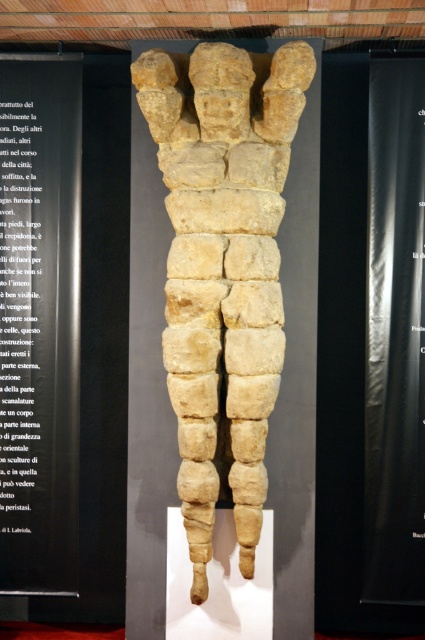
Question: Is yellow stone statue at center bigger than black matte poster at right?

Choices:
 (A) no
 (B) yes

Answer: (B)

Question: Which point is farther to the camera?

Choices:
 (A) (16, 163)
 (B) (368, 134)
 (C) (67, 580)

Answer: (C)

Question: Which object is positioned closest to the black paper at left?

Choices:
 (A) black paper at upper left
 (B) black matte poster at right
 (C) yellow stone statue at center

Answer: (A)

Question: Which object is the closest to the black paper at left?

Choices:
 (A) yellow stone statue at center
 (B) black matte poster at right

Answer: (A)

Question: Observing the image, what is the correct spatial positioning of black paper at left in reference to black matte poster at right?

Choices:
 (A) left
 (B) right

Answer: (A)

Question: Does black matte poster at right come behind black paper at upper left?

Choices:
 (A) yes
 (B) no

Answer: (B)